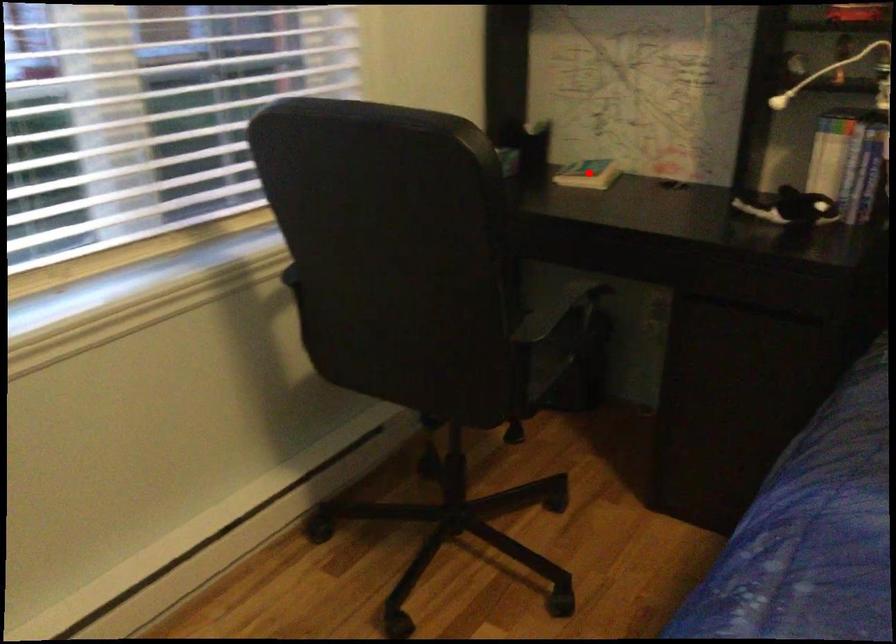
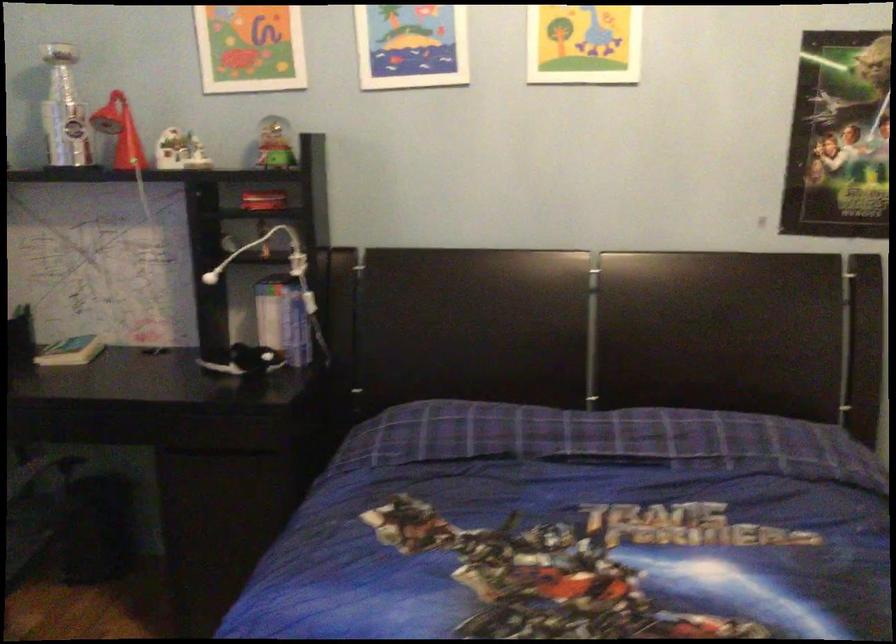
Where in the second image is the point corresponding to the highlighted location from the first image?

(71, 351)